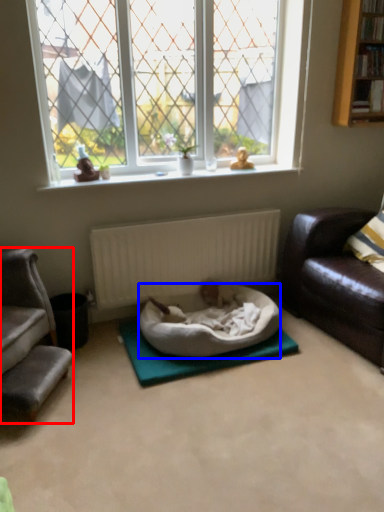
Question: Which object appears closest to the camera in this image, studio couch (highlighted by a red box) or dog bed (highlighted by a blue box)?

Choices:
 (A) studio couch
 (B) dog bed

Answer: (A)